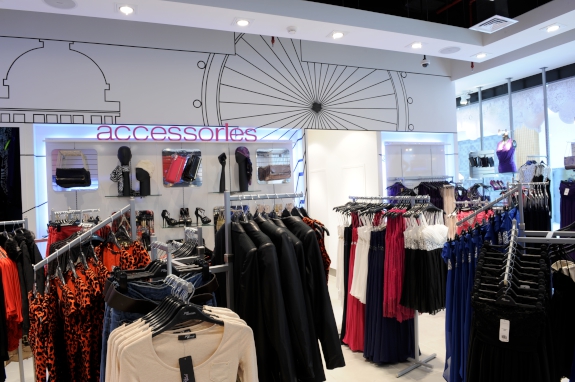
Locate an element on the screen. Image resolution: width=575 pixels, height=382 pixels. ceiling pole is located at coordinates (477, 118), (513, 114), (546, 112).